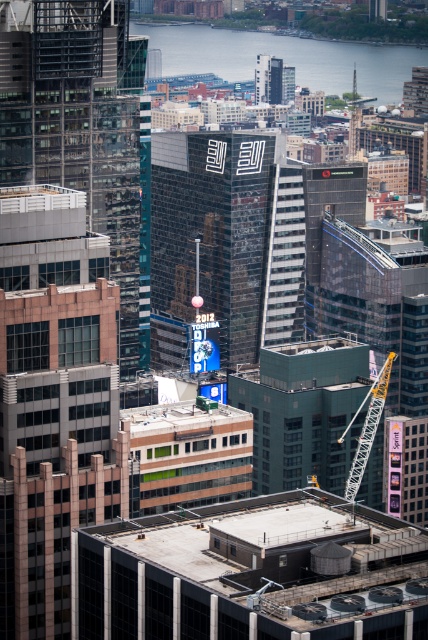
You are a city planner reviewing the urban landscape. You observe the blue glass water at upper center. Where exactly is this located in the image?

The blue glass water at upper center is located at point coordinates of (285, 58).